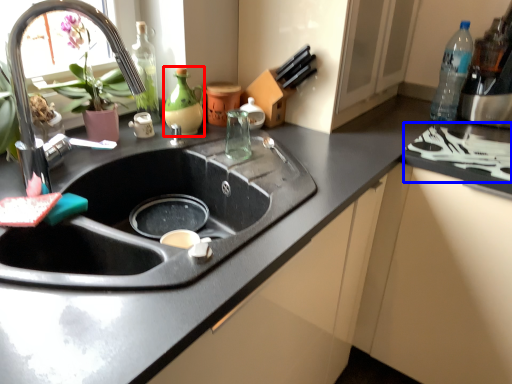
Question: Among these objects, which one is farthest to the camera, bottle (highlighted by a red box) or stove (highlighted by a blue box)?

Choices:
 (A) bottle
 (B) stove

Answer: (A)